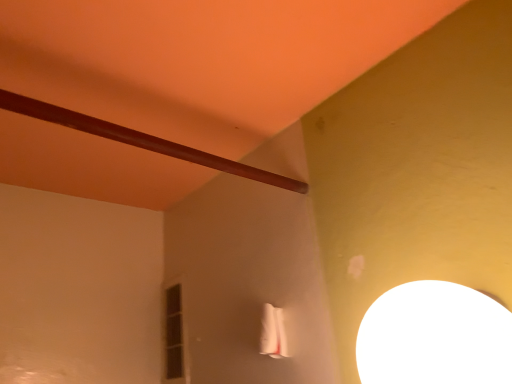
Question: Does brown polished wood beam at upper left have a larger size compared to matte glass window at center left?

Choices:
 (A) no
 (B) yes

Answer: (A)

Question: Does brown polished wood beam at upper left have a greater height compared to matte glass window at center left?

Choices:
 (A) no
 (B) yes

Answer: (A)

Question: From a real-world perspective, is brown polished wood beam at upper left under matte glass window at center left?

Choices:
 (A) yes
 (B) no

Answer: (B)

Question: Would you say brown polished wood beam at upper left is outside matte glass window at center left?

Choices:
 (A) yes
 (B) no

Answer: (A)

Question: From a real-world perspective, is brown polished wood beam at upper left on top of matte glass window at center left?

Choices:
 (A) yes
 (B) no

Answer: (A)

Question: Considering their positions, is brown polished wood beam at upper left located in front of or behind matte glass window at center left?

Choices:
 (A) front
 (B) behind

Answer: (A)

Question: In terms of width, does brown polished wood beam at upper left look wider or thinner when compared to matte glass window at center left?

Choices:
 (A) thin
 (B) wide

Answer: (B)

Question: Which is correct: brown polished wood beam at upper left is inside matte glass window at center left, or outside of it?

Choices:
 (A) inside
 (B) outside

Answer: (B)

Question: In the image, is brown polished wood beam at upper left on the left side or the right side of matte glass window at center left?

Choices:
 (A) left
 (B) right

Answer: (B)

Question: In the image, is brown polished wood beam at upper left on the left side or the right side of white glossy lampshade at upper right?

Choices:
 (A) left
 (B) right

Answer: (A)

Question: From the image's perspective, is brown polished wood beam at upper left located above or below white glossy lampshade at upper right?

Choices:
 (A) above
 (B) below

Answer: (A)

Question: Considering the positions of brown polished wood beam at upper left and white glossy lampshade at upper right in the image, is brown polished wood beam at upper left taller or shorter than white glossy lampshade at upper right?

Choices:
 (A) tall
 (B) short

Answer: (B)

Question: Is brown polished wood beam at upper left wider or thinner than white glossy lampshade at upper right?

Choices:
 (A) wide
 (B) thin

Answer: (B)

Question: Considering the positions of white glossy lampshade at upper right and matte glass window at center left in the image, is white glossy lampshade at upper right bigger or smaller than matte glass window at center left?

Choices:
 (A) small
 (B) big

Answer: (B)

Question: From a real-world perspective, is white glossy lampshade at upper right positioned above or below matte glass window at center left?

Choices:
 (A) below
 (B) above

Answer: (A)